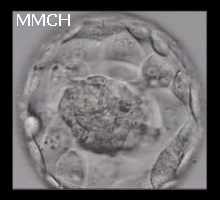
Locate an element on the screen. The width and height of the screenshot is (220, 200). black frame is located at coordinates (4, 52).